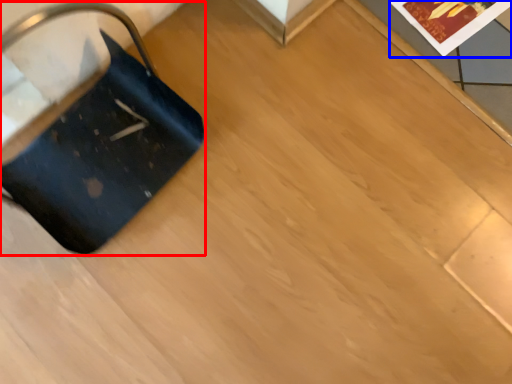
Question: Which object is further to the camera taking this photo, luggage (highlighted by a red box) or postcard (highlighted by a blue box)?

Choices:
 (A) luggage
 (B) postcard

Answer: (B)